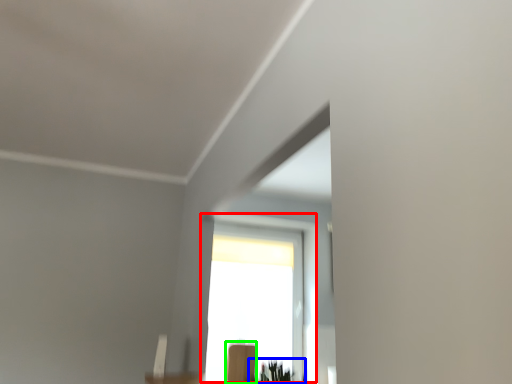
Question: Considering the real-world distances, which object is closest to window (highlighted by a red box)? plant (highlighted by a blue box) or furniture (highlighted by a green box).

Choices:
 (A) plant
 (B) furniture

Answer: (B)